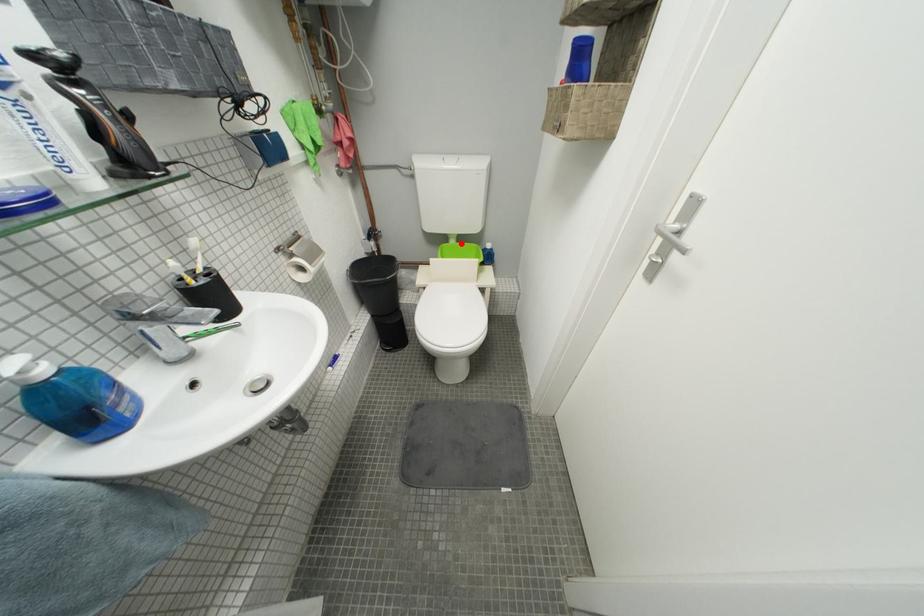
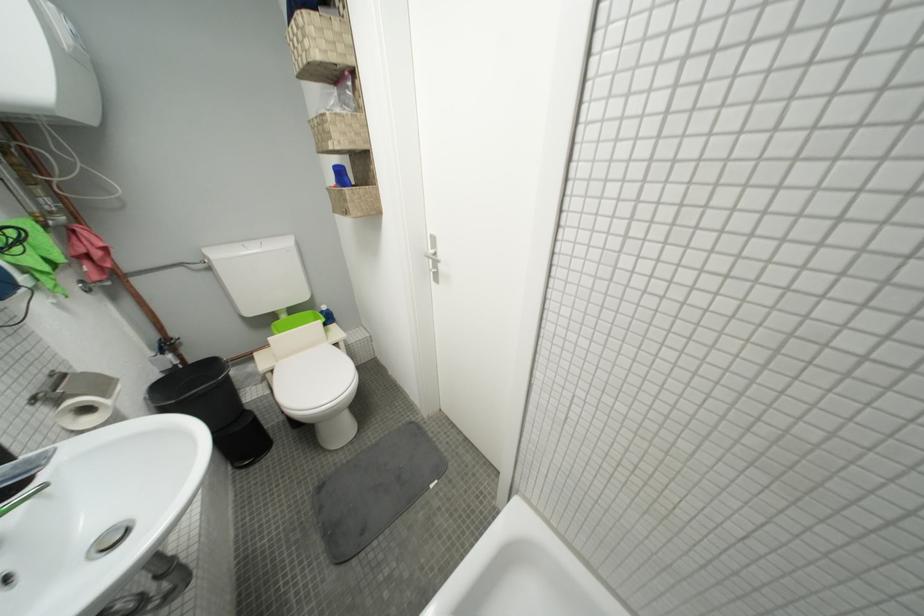
Question: I am providing you with two images of the same scene from different viewpoints. In image1, a red point is highlighted. Considering the same 3D point in image2, which of the following is correct?

Choices:
 (A) It is closer
 (B) It is farther

Answer: (A)